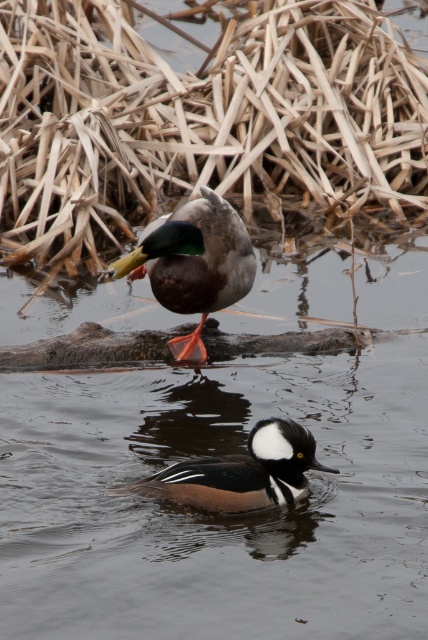
Question: Which of the following is the closest to the observer?

Choices:
 (A) (321, 36)
 (B) (184, 468)
 (C) (181, 221)

Answer: (B)

Question: Which object is the farthest from the brown dry reed at upper center?

Choices:
 (A) shiny brown duck at center
 (B) brown speckled duck at center

Answer: (B)

Question: Estimate the real-world distances between objects in this image. Which object is farther from the brown speckled duck at center?

Choices:
 (A) shiny brown duck at center
 (B) brown dry reed at upper center

Answer: (B)

Question: Does brown dry reed at upper center come behind brown speckled duck at center?

Choices:
 (A) yes
 (B) no

Answer: (A)

Question: Can you confirm if shiny brown duck at center is bigger than brown speckled duck at center?

Choices:
 (A) yes
 (B) no

Answer: (A)

Question: Can you confirm if brown dry reed at upper center is thinner than shiny brown duck at center?

Choices:
 (A) yes
 (B) no

Answer: (B)